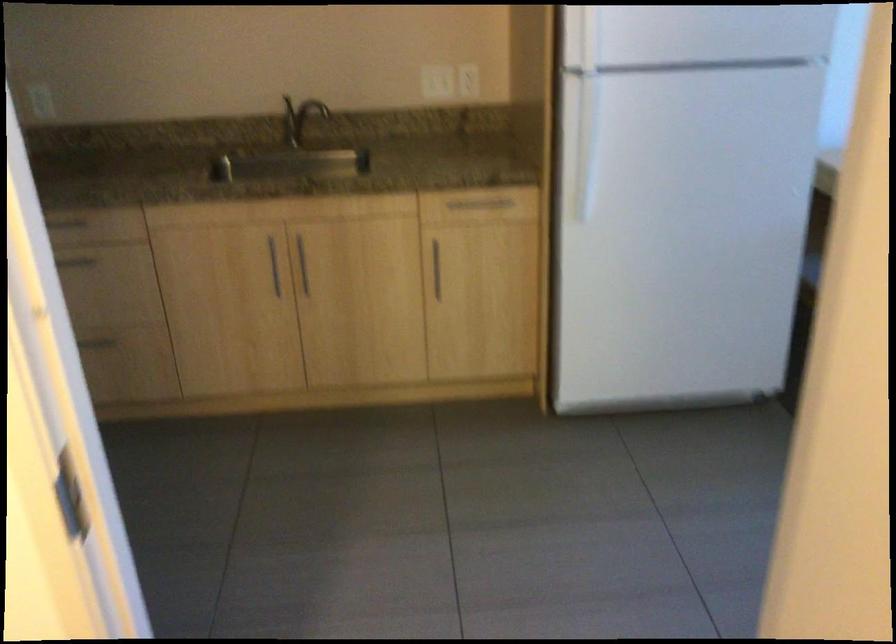
Describe the element at coordinates (586, 146) in the screenshot. I see `the refrigerator handle` at that location.